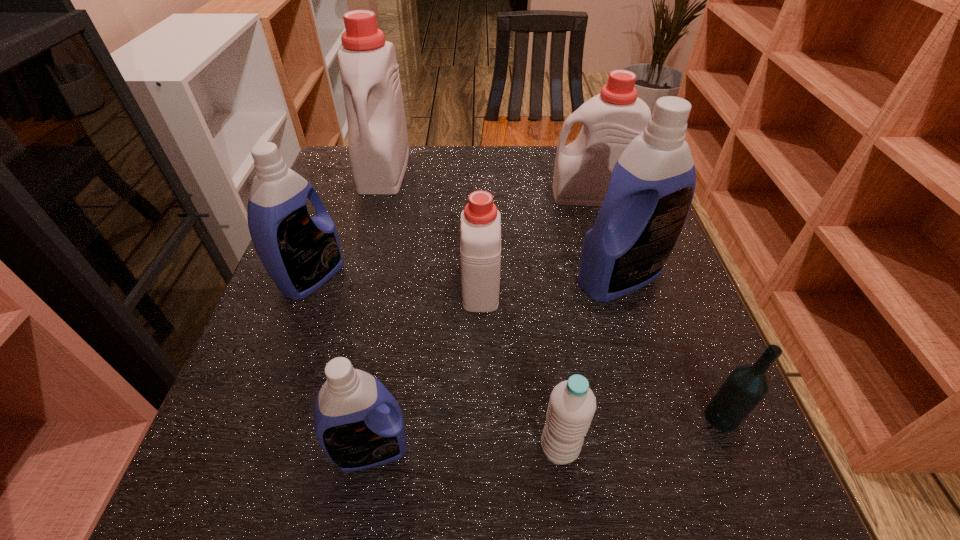
Where is `the fifth object from left to right`? The width and height of the screenshot is (960, 540). the fifth object from left to right is located at coordinates (572, 404).

Locate an element on the screen. This screenshot has width=960, height=540. vacant region located on the handle side of the biggest white detergent is located at coordinates (x=348, y=302).

What are the coordinates of `vacant space located 0.200m on the back of the rightmost blue detergent` in the screenshot? It's located at (595, 199).

This screenshot has height=540, width=960. Find the location of `vacant space located 0.110m on the right of the leftmost blue detergent`. vacant space located 0.110m on the right of the leftmost blue detergent is located at coordinates (395, 278).

The image size is (960, 540). Identify the location of vacant area situated on the handle side of the rightmost white detergent. (532, 195).

You are a GUI agent. You are given a task and a screenshot of the screen. Output one action in this format:
    pyautogui.click(x=<x>, y=<y>)
    Task: Click on the vacant space located 0.060m on the handle side of the rightmost white detergent
    
    Given the screenshot: What is the action you would take?
    pyautogui.click(x=527, y=195)

At what (x,y) coordinates should I click in order to perform the action: click on free region located 0.170m on the handle side of the rightmost white detergent. Please return your answer as a coordinate pair (x, y). The width and height of the screenshot is (960, 540). Looking at the image, I should click on (484, 195).

Image resolution: width=960 pixels, height=540 pixels. I want to click on vacant region located on the handle side of the smallest white detergent, so click(x=480, y=185).

Locate an element on the screen. free space located on the handle side of the smallest white detergent is located at coordinates (481, 192).

Find the location of a particular element. Image resolution: width=960 pixels, height=540 pixels. free region located 0.340m on the handle side of the smallest white detergent is located at coordinates (480, 172).